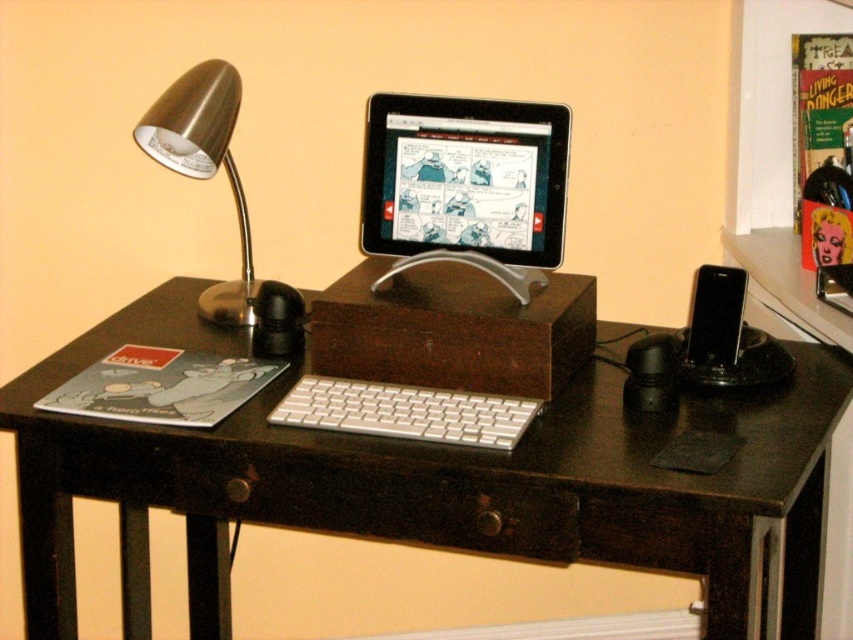
You are setting up a new monitor stand on the desk. The stand requires a space that is wider than the brushed metal desk lamp at left but narrower than the white aluminum keyboard at center. Is there enough space between them for this monitor stand?

The brushed metal desk lamp at left is thinner than the white aluminum keyboard at center, so there is a space between them that is wider than the lamp but narrower than the keyboard. Therefore, the monitor stand can fit in that space.

You are sitting at the desk and want to reach both the white plastic keyboard at center and the black wood drawer at center. Which one can you reach without moving your chair?

The white plastic keyboard at center is closer to the viewer than the black wood drawer at center, so you can reach it without moving your chair.